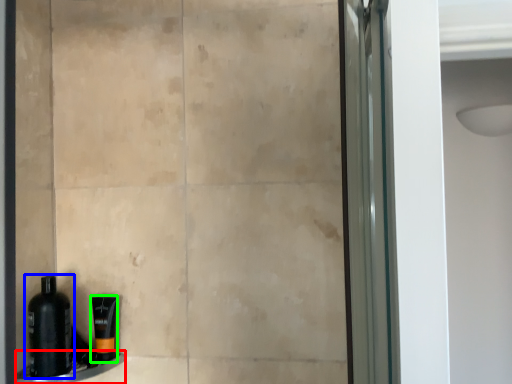
Question: Which object is the farthest from ledge (highlighted by a red box)? Choose among these: bottle (highlighted by a blue box) or toiletry (highlighted by a green box).

Choices:
 (A) bottle
 (B) toiletry

Answer: (A)